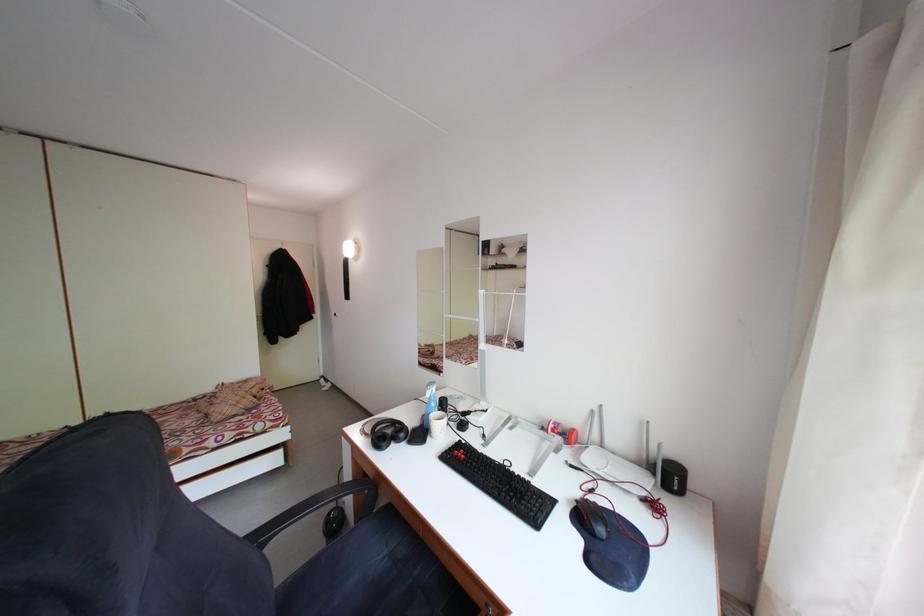
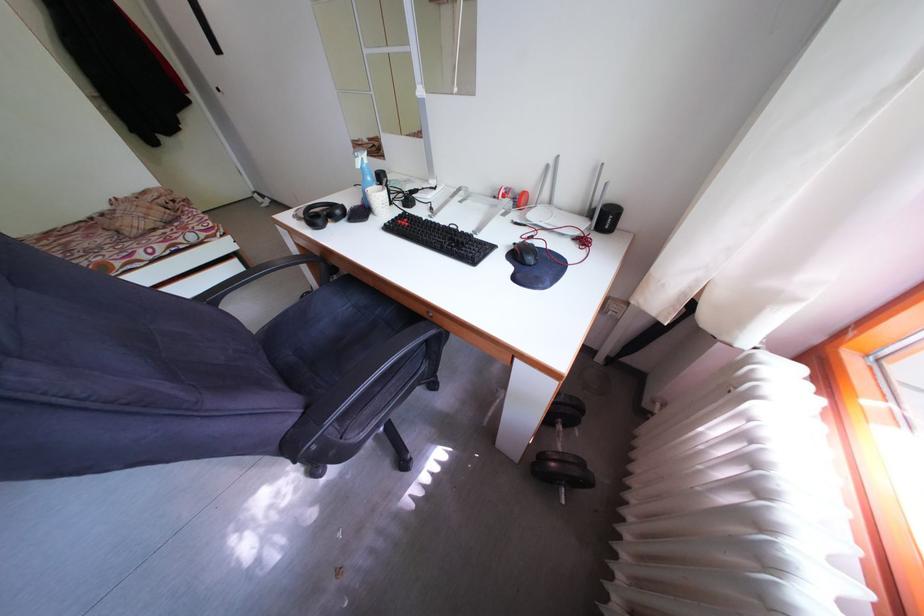
Where in the second image is the point corresponding to (x=601, y=418) from the first image?

(555, 172)